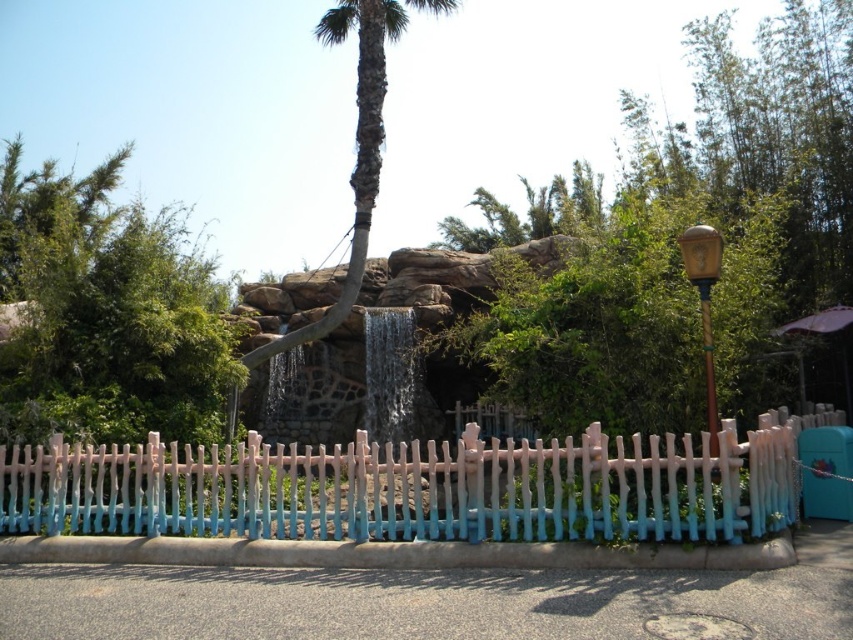
Is the position of green leafy tree at upper left less distant than that of green textured palm tree at center?

That is True.

Is point (62, 211) farther from viewer compared to point (373, 92)?

No, it is not.

Who is more forward, (212, 436) or (347, 273)?

Point (212, 436)

This screenshot has width=853, height=640. I want to click on green leafy tree at upper left, so click(x=106, y=314).

Who is higher up, pastel wood picket fence at lower center or green leafy tree at upper left?

green leafy tree at upper left is above.

Who is shorter, pastel wood picket fence at lower center or green leafy tree at upper left?

pastel wood picket fence at lower center

Where is `pastel wood picket fence at lower center`? pastel wood picket fence at lower center is located at coordinates (416, 486).

Between pastel wood picket fence at lower center and green textured palm tree at center, which one is positioned higher?

green textured palm tree at center is higher up.

Can you confirm if pastel wood picket fence at lower center is positioned to the left of green textured palm tree at center?

Incorrect, pastel wood picket fence at lower center is not on the left side of green textured palm tree at center.

Describe the element at coordinates (416, 486) in the screenshot. The width and height of the screenshot is (853, 640). I see `pastel wood picket fence at lower center` at that location.

You are a GUI agent. You are given a task and a screenshot of the screen. Output one action in this format:
    pyautogui.click(x=<x>, y=<y>)
    Task: Click on the pastel wood picket fence at lower center
    The width and height of the screenshot is (853, 640).
    Given the screenshot: What is the action you would take?
    pyautogui.click(x=416, y=486)